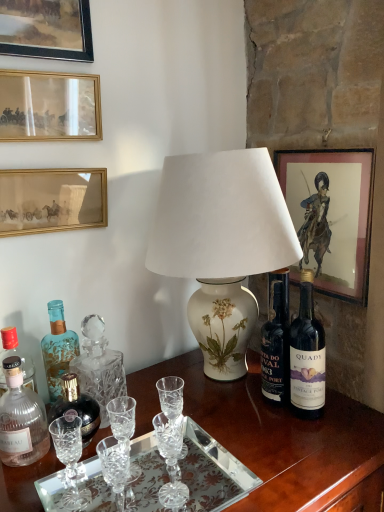
You are a GUI agent. You are given a task and a screenshot of the screen. Output one action in this format:
    pyautogui.click(x=<x>, y=<y>)
    Task: Click on the free space in front of dark glass bottle at right
    This screenshot has height=512, width=384.
    Given the screenshot: What is the action you would take?
    pyautogui.click(x=313, y=458)